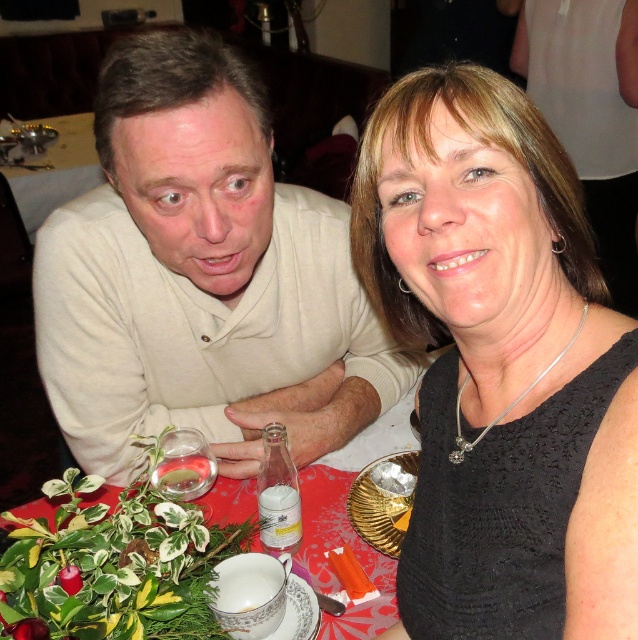
Question: Which object is positioned farthest from the black lace dress at center?

Choices:
 (A) clear glass water at left
 (B) white matte shirt at left

Answer: (A)

Question: Is black lace dress at center in front of clear glass water at left?

Choices:
 (A) no
 (B) yes

Answer: (B)

Question: Which of the following is the farthest from the observer?

Choices:
 (A) white matte shirt at left
 (B) black lace dress at center
 (C) clear glass water at left

Answer: (C)

Question: In this image, where is white matte shirt at left located relative to clear glass water at left?

Choices:
 (A) left
 (B) right

Answer: (B)

Question: Is black lace dress at center behind white matte shirt at left?

Choices:
 (A) yes
 (B) no

Answer: (B)

Question: Estimate the real-world distances between objects in this image. Which object is closer to the black lace dress at center?

Choices:
 (A) white matte shirt at left
 (B) clear glass water at left

Answer: (A)